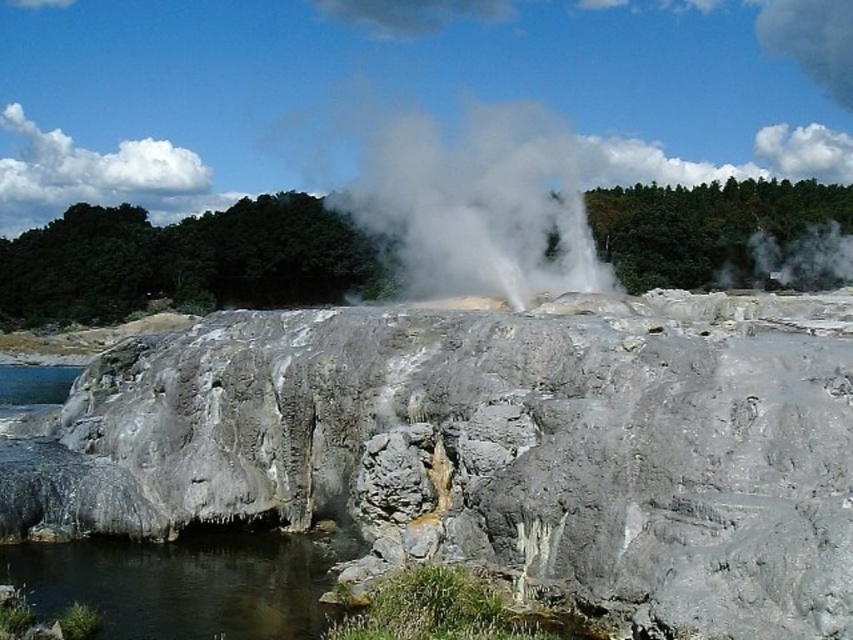
Does gray rocky geyser at center have a greater width compared to clear water at lower left?

Correct, the width of gray rocky geyser at center exceeds that of clear water at lower left.

This screenshot has height=640, width=853. Identify the location of gray rocky geyser at center. (184, 260).

Identify the location of gray rocky geyser at center. This screenshot has width=853, height=640. (184, 260).

Who is shorter, gray rocky geyser at center or white vapor at center?

Standing shorter between the two is gray rocky geyser at center.

Identify the location of gray rocky geyser at center. The height and width of the screenshot is (640, 853). (184, 260).

Is point (618, 483) farther from viewer compared to point (489, 152)?

No, it is not.

What do you see at coordinates (491, 448) in the screenshot?
I see `gray rough cliff at center` at bounding box center [491, 448].

I want to click on gray rough cliff at center, so click(x=491, y=448).